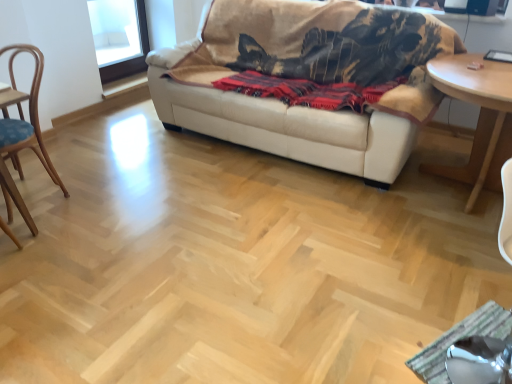
Question: Is light brown wooden table at right further to the viewer compared to beige leather couch at upper center?

Choices:
 (A) yes
 (B) no

Answer: (B)

Question: Does light brown wooden table at right have a smaller size compared to beige leather couch at upper center?

Choices:
 (A) yes
 (B) no

Answer: (A)

Question: Could you tell me if light brown wooden table at right is turned towards beige leather couch at upper center?

Choices:
 (A) no
 (B) yes

Answer: (A)

Question: From a real-world perspective, is light brown wooden table at right over beige leather couch at upper center?

Choices:
 (A) no
 (B) yes

Answer: (A)

Question: Does light brown wooden table at right have a greater height compared to beige leather couch at upper center?

Choices:
 (A) no
 (B) yes

Answer: (A)

Question: Relative to light brown wooden table at right, is wooden chair at left in front or behind?

Choices:
 (A) front
 (B) behind

Answer: (A)

Question: Considering the positions of wooden chair at left and light brown wooden table at right in the image, is wooden chair at left taller or shorter than light brown wooden table at right?

Choices:
 (A) tall
 (B) short

Answer: (A)

Question: Looking at the image, does wooden chair at left seem bigger or smaller compared to light brown wooden table at right?

Choices:
 (A) big
 (B) small

Answer: (B)

Question: Is wooden chair at left inside or outside of light brown wooden table at right?

Choices:
 (A) outside
 (B) inside

Answer: (A)

Question: From a real-world perspective, is beige leather couch at upper center physically located above or below metallic silver swivel chair at lower right?

Choices:
 (A) below
 (B) above

Answer: (B)

Question: In terms of width, does beige leather couch at upper center look wider or thinner when compared to metallic silver swivel chair at lower right?

Choices:
 (A) wide
 (B) thin

Answer: (A)

Question: Would you say beige leather couch at upper center is inside or outside metallic silver swivel chair at lower right?

Choices:
 (A) inside
 (B) outside

Answer: (B)

Question: Relative to metallic silver swivel chair at lower right, is beige leather couch at upper center in front or behind?

Choices:
 (A) behind
 (B) front

Answer: (A)

Question: Would you say metallic silver swivel chair at lower right is to the left or to the right of light brown wooden table at right in the picture?

Choices:
 (A) left
 (B) right

Answer: (A)

Question: Choose the correct answer: Is metallic silver swivel chair at lower right inside light brown wooden table at right or outside it?

Choices:
 (A) inside
 (B) outside

Answer: (B)